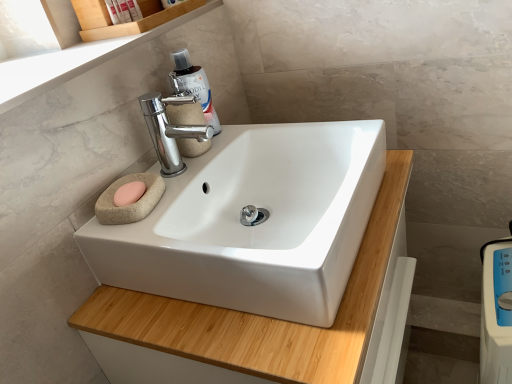
Question: Considering the positions of translucent plastic bottle at upper center and white plastic bottle at upper left, acting as the 2th toiletry starting from the left, in the image, is translucent plastic bottle at upper center taller or shorter than white plastic bottle at upper left, acting as the 2th toiletry starting from the left,?

Choices:
 (A) tall
 (B) short

Answer: (A)

Question: From the image's perspective, is translucent plastic bottle at upper center positioned above or below white plastic bottle at upper left, placed as the first toiletry when sorted from right to left?

Choices:
 (A) above
 (B) below

Answer: (B)

Question: Which is farther from the translucent plastic bottle at upper center?

Choices:
 (A) white glossy sink at center
 (B) white plastic scale at lower right
 (C) white plastic bottle at upper left, placed as the first toiletry when sorted from right to left
 (D) pink matte soap at left
 (E) matte plastic soap at upper left, the second toiletry when ordered from right to left

Answer: (B)

Question: Which object is the closest to the white glossy sink at center?

Choices:
 (A) translucent plastic bottle at upper center
 (B) white plastic bottle at upper left, acting as the 2th toiletry starting from the left
 (C) white plastic scale at lower right
 (D) pink matte soap at left
 (E) polished chrome faucet at upper center

Answer: (D)